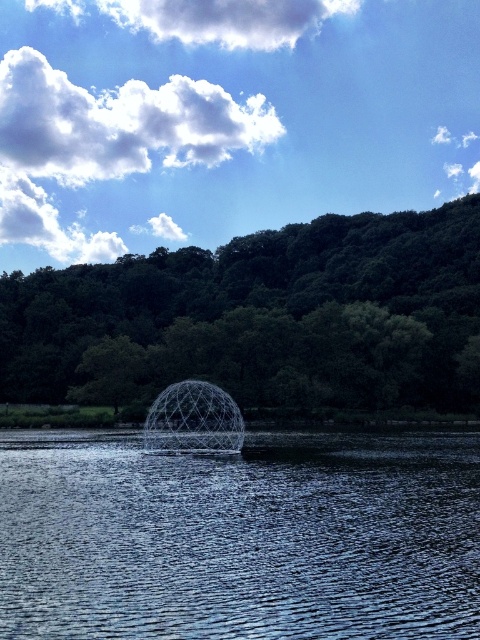
You are a bird soaring above the landscape. You see the glistening blue water at center and the green leafy tree at center. Which one is closer to the ground?

The glistening blue water at center is positioned under green leafy tree at center, so the glistening blue water at center is closer to the ground.